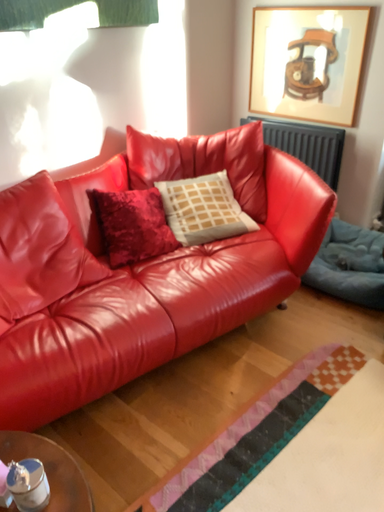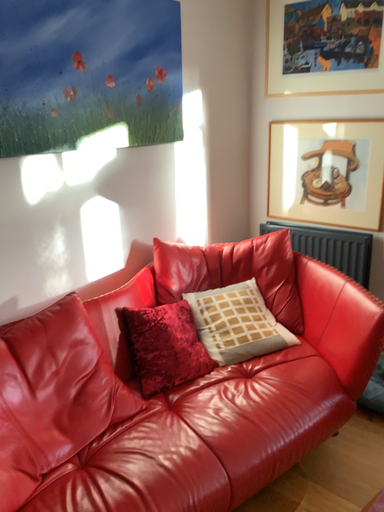
Question: Which way did the camera rotate in the video?

Choices:
 (A) rotated upward
 (B) rotated downward

Answer: (A)